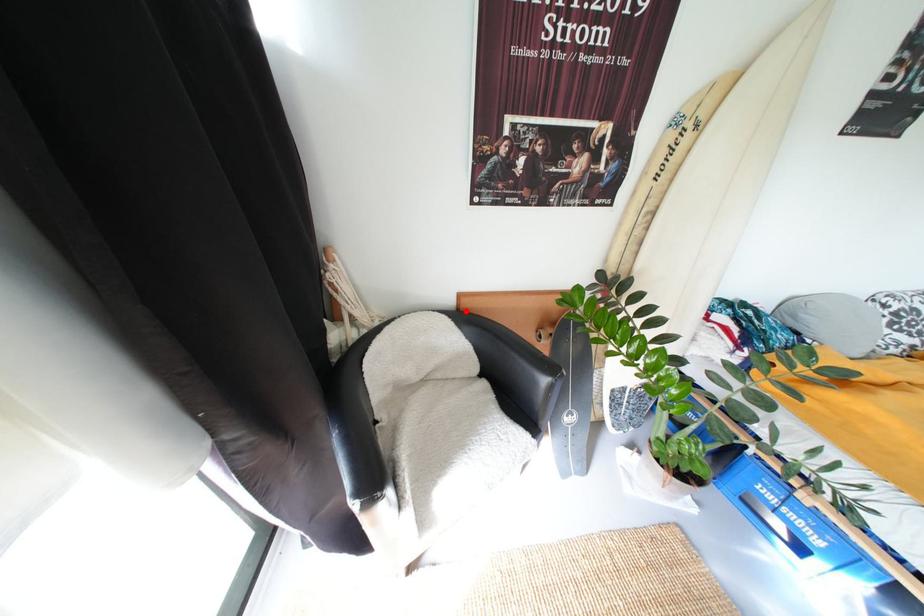
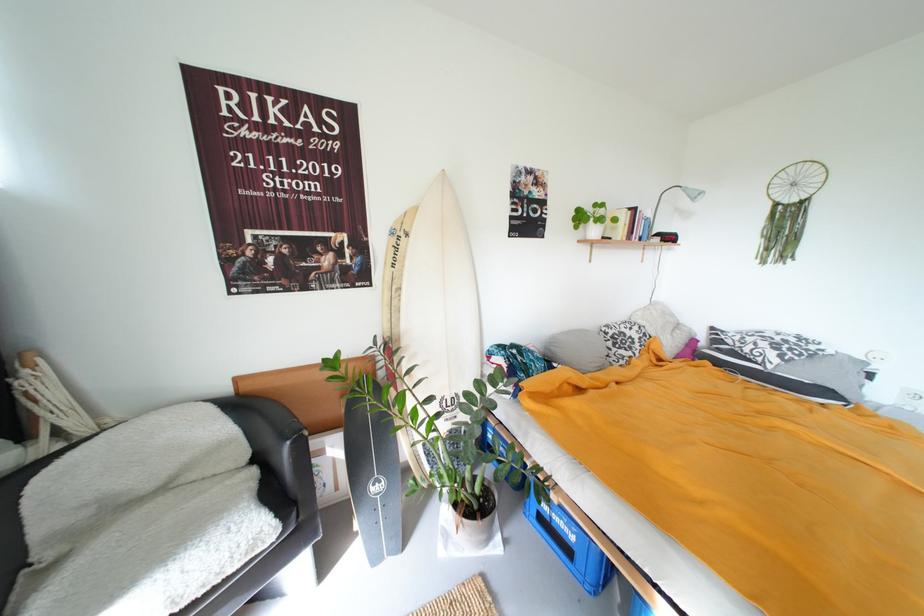
In the second image, find the point that corresponds to the highlighted location in the first image.

(246, 395)